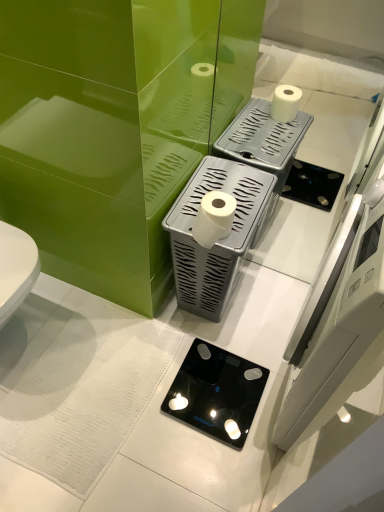
Question: In which direction should I rotate to look at white plastic toilet paper holder at center, which is counted as the 2th appliance, starting from the bottom?

Choices:
 (A) right
 (B) left

Answer: (A)

Question: Is black glass scale at center, the second appliance when ordered from top to bottom, thinner than white matte toilet paper at center?

Choices:
 (A) no
 (B) yes

Answer: (A)

Question: From a real-world perspective, does black glass scale at center, the second appliance when ordered from top to bottom, sit lower than white matte toilet paper at center?

Choices:
 (A) no
 (B) yes

Answer: (B)

Question: Are black glass scale at center, the second appliance when ordered from top to bottom, and white matte toilet paper at center far apart?

Choices:
 (A) no
 (B) yes

Answer: (A)

Question: Does black glass scale at center, marked as the 1th appliance in a bottom-to-top arrangement, lie behind white matte toilet paper at center?

Choices:
 (A) yes
 (B) no

Answer: (A)

Question: Is black glass scale at center, the second appliance when ordered from top to bottom, to the right of white matte toilet paper at center from the viewer's perspective?

Choices:
 (A) yes
 (B) no

Answer: (A)

Question: Is black glass scale at center, marked as the 1th appliance in a bottom-to-top arrangement, looking in the opposite direction of white matte toilet paper at center?

Choices:
 (A) no
 (B) yes

Answer: (A)

Question: Could you tell me if black glass scale at center, the second appliance when ordered from top to bottom, is turned towards white plastic toilet paper holder at center, the first appliance viewed from the top?

Choices:
 (A) yes
 (B) no

Answer: (B)

Question: Can you confirm if black glass scale at center, the second appliance when ordered from top to bottom, is thinner than white plastic toilet paper holder at center, which is counted as the 2th appliance, starting from the bottom?

Choices:
 (A) yes
 (B) no

Answer: (B)

Question: Is black glass scale at center, the second appliance when ordered from top to bottom, shorter than white plastic toilet paper holder at center, the first appliance viewed from the top?

Choices:
 (A) no
 (B) yes

Answer: (B)

Question: Is black glass scale at center, marked as the 1th appliance in a bottom-to-top arrangement, to the left of white plastic toilet paper holder at center, the first appliance viewed from the top, from the viewer's perspective?

Choices:
 (A) no
 (B) yes

Answer: (B)

Question: Does black glass scale at center, the second appliance when ordered from top to bottom, have a larger size compared to white plastic toilet paper holder at center, the first appliance viewed from the top?

Choices:
 (A) no
 (B) yes

Answer: (A)

Question: Would you say black glass scale at center, the second appliance when ordered from top to bottom, is outside white plastic toilet paper holder at center, the first appliance viewed from the top?

Choices:
 (A) no
 (B) yes

Answer: (B)

Question: Is white matte toilet paper at center to the left of black glass scale at center, the second appliance when ordered from top to bottom, from the viewer's perspective?

Choices:
 (A) no
 (B) yes

Answer: (B)